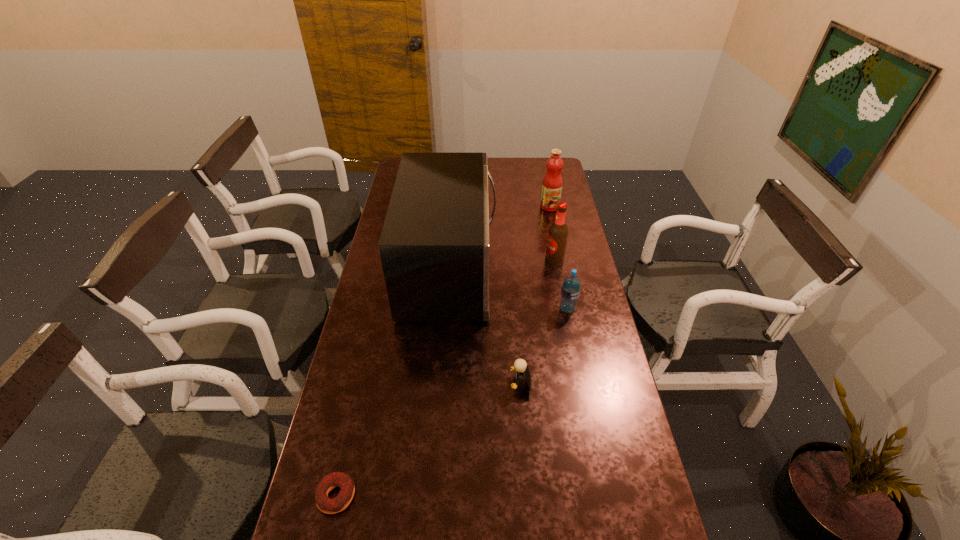
Find the location of a particular element. The width and height of the screenshot is (960, 540). unoccupied position between the Lego and the nearest object is located at coordinates (428, 439).

Identify the location of vacant area that lies between the fifth object from right to left and the water bottle. (509, 289).

Where is `vacant space in between the beer bottle and the fifth farthest object`? vacant space in between the beer bottle and the fifth farthest object is located at coordinates (538, 322).

Where is `free area in between the beer bottle and the fifth object from right to left`? free area in between the beer bottle and the fifth object from right to left is located at coordinates (502, 265).

Locate which object ranks fifth in proximity to the water bottle. Please provide its 2D coordinates. Your answer should be formatted as a tuple, i.e. [(x, y)], where the tuple contains the x and y coordinates of a point satisfying the conditions above.

[(325, 504)]

Locate an element on the screen. object that is the third nearest to the second nearest object is located at coordinates (325, 504).

Where is `free spot that satisfies the following two spatial constraints: 1. on the front label of the farthest object; 2. on the front-facing side of the Lego`? free spot that satisfies the following two spatial constraints: 1. on the front label of the farthest object; 2. on the front-facing side of the Lego is located at coordinates (586, 383).

Locate an element on the screen. free region that satisfies the following two spatial constraints: 1. with the door open on the microwave oven; 2. on the back side of the fourth tallest object is located at coordinates [446, 309].

I want to click on vacant space that satisfies the following two spatial constraints: 1. on the front label of the fruit juice; 2. with the door open on the microwave oven, so click(563, 269).

Identify the location of vacant area in the image that satisfies the following two spatial constraints: 1. with the door open on the fourth tallest object; 2. on the left side of the fifth object from right to left. The height and width of the screenshot is (540, 960). (446, 309).